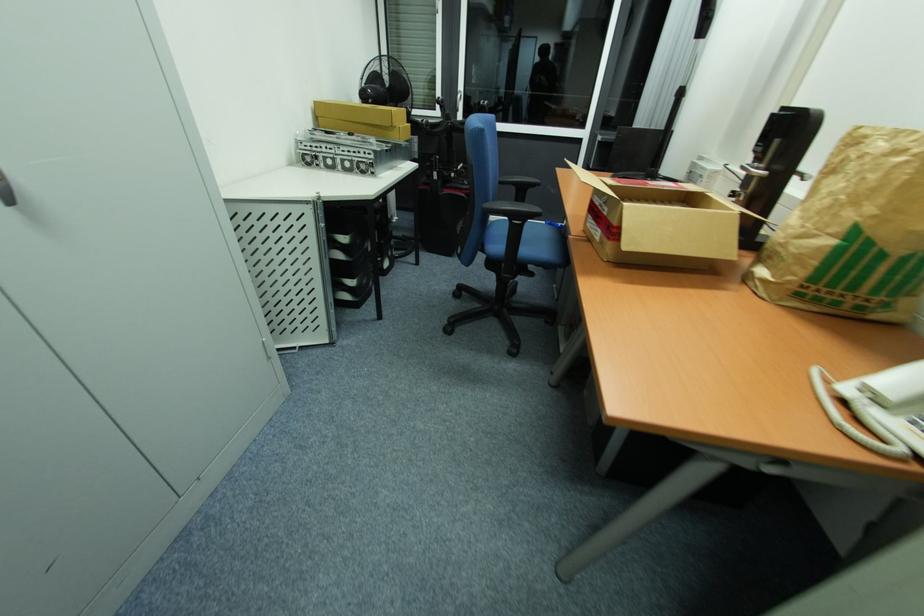
Where would you sit the chair sitting surface? Please return your answer as a coordinate pair (x, y).

(524, 238)